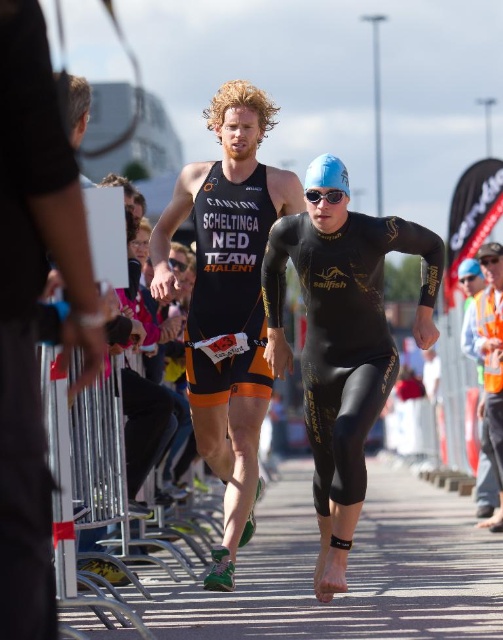
Question: Which point is farther from the camera taking this photo?

Choices:
 (A) (313, 163)
 (B) (315, 204)

Answer: (A)

Question: Which object is closer to the camera taking this photo?

Choices:
 (A) black triathlon suit at center
 (B) orange matte triathlon suit at center
 (C) blue matte swim cap at center
 (D) black matte goggles at center

Answer: (A)

Question: Is black matte wetsuit at center bigger than orange matte triathlon suit at center?

Choices:
 (A) yes
 (B) no

Answer: (A)

Question: Does matte black triathlon suit at center appear on the left side of blue matte swim cap at upper center?

Choices:
 (A) no
 (B) yes

Answer: (B)

Question: Among these points, which one is nearest to the camera?

Choices:
 (A) (334, 193)
 (B) (208, 573)
 (C) (375, 280)
 (D) (471, 266)

Answer: (A)

Question: Is black matte wetsuit at center to the right of blue matte swim cap at upper center from the viewer's perspective?

Choices:
 (A) yes
 (B) no

Answer: (B)